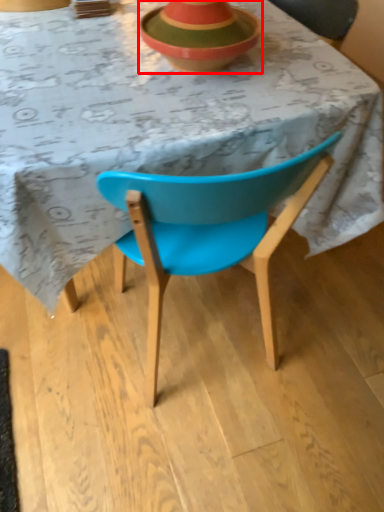
Question: From the image's perspective, where is bowl (annotated by the red box) located in relation to table in the image?

Choices:
 (A) above
 (B) below

Answer: (A)